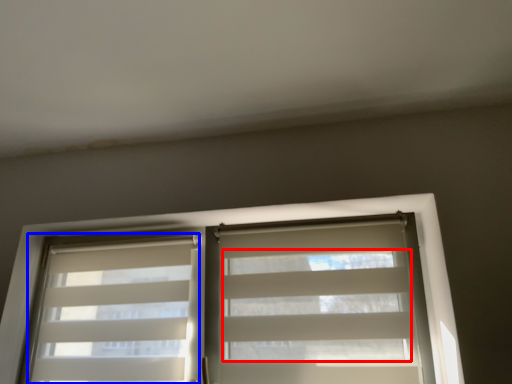
Question: Which object is further to the camera taking this photo, blind (highlighted by a red box) or shutter (highlighted by a blue box)?

Choices:
 (A) blind
 (B) shutter

Answer: (B)